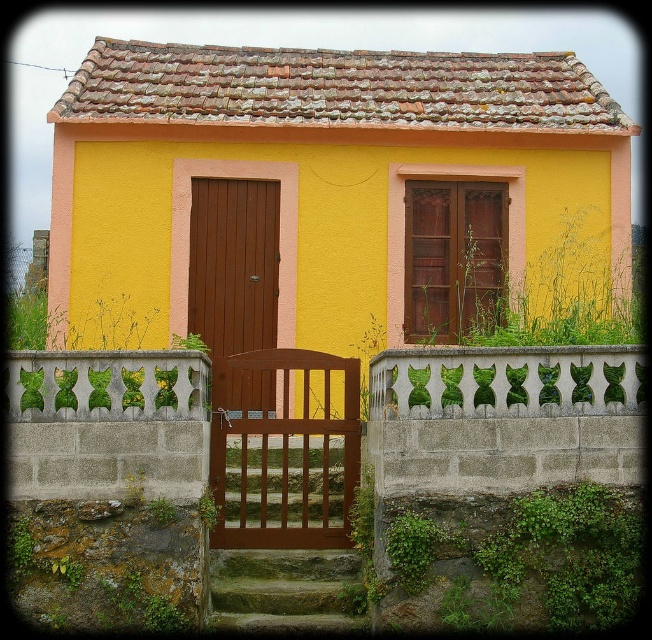
Question: Which point appears farthest from the camera in this image?

Choices:
 (A) (216, 529)
 (B) (261, 189)

Answer: (B)

Question: Which object is closer to the camera taking this photo?

Choices:
 (A) brown wooden gate at center
 (B) brown wooden door at center

Answer: (A)

Question: Observing the image, what is the correct spatial positioning of brown wooden gate at center in reference to brown wooden door at center?

Choices:
 (A) right
 (B) left

Answer: (A)

Question: Can you confirm if brown wooden gate at center is positioned below brown wooden door at center?

Choices:
 (A) yes
 (B) no

Answer: (A)

Question: Does brown wooden gate at center lie in front of brown wooden door at center?

Choices:
 (A) no
 (B) yes

Answer: (B)